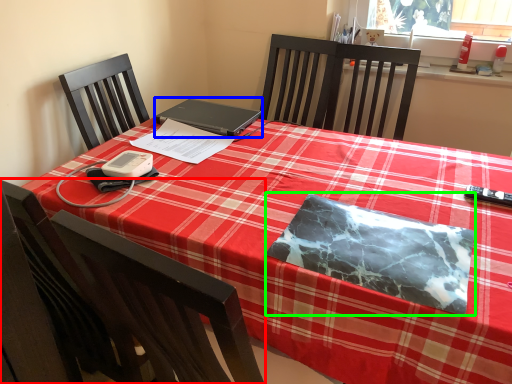
Question: Which object is positioned farthest from chair (highlighted by a red box)? Select from laptop (highlighted by a blue box) and notebook (highlighted by a green box).

Choices:
 (A) laptop
 (B) notebook

Answer: (A)